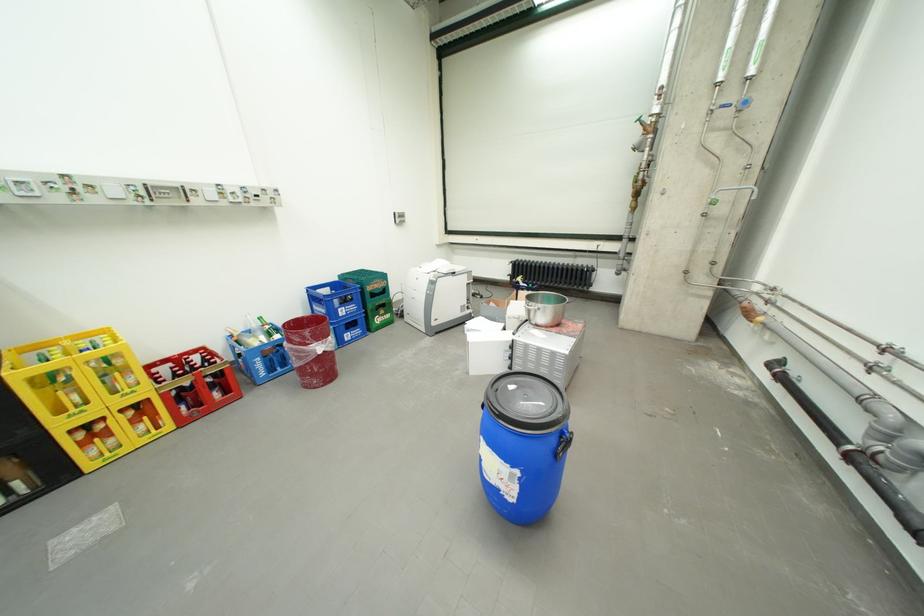
What do you see at coordinates (530, 305) in the screenshot?
I see `the silver pot handle` at bounding box center [530, 305].